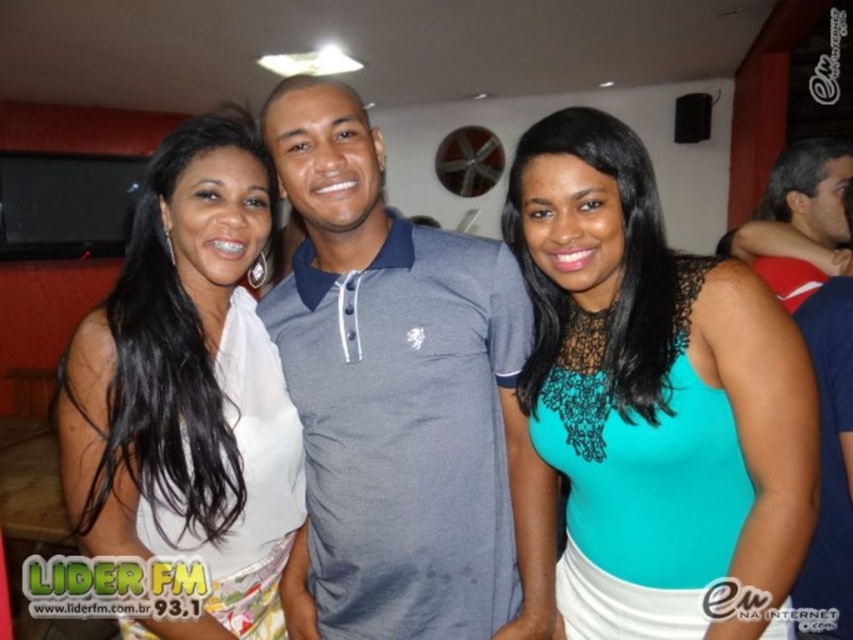
You are at a party and want to take a photo with the gray cotton polo shirt at center and the teal lace tank top at center. Which one is to the left of the other?

The gray cotton polo shirt at center is positioned on the left side of teal lace tank top at center.

You are at a social event and want to take a photo of the teal lace tank top at center. Where should you position yourself to capture it in the frame?

The teal lace tank top at center is located at point (656,372), so you should position yourself directly in front of that coordinate to capture it in the frame.